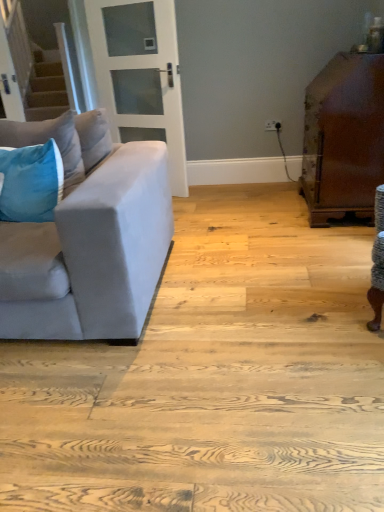
Question: From the image's perspective, does velvet blue pillow at left, the first pillow viewed from the top, appear higher than white glass door at upper center?

Choices:
 (A) yes
 (B) no

Answer: (B)

Question: Is velvet blue pillow at left, the 2th pillow in the bottom-to-top sequence, thinner than white glass door at upper center?

Choices:
 (A) yes
 (B) no

Answer: (B)

Question: Is the position of velvet blue pillow at left, the 2th pillow in the bottom-to-top sequence, less distant than that of white glass door at upper center?

Choices:
 (A) no
 (B) yes

Answer: (B)

Question: Considering the relative positions of velvet blue pillow at left, the first pillow viewed from the top, and white glass door at upper center in the image provided, is velvet blue pillow at left, the first pillow viewed from the top, to the left of white glass door at upper center from the viewer's perspective?

Choices:
 (A) yes
 (B) no

Answer: (A)

Question: Can you confirm if velvet blue pillow at left, the 2th pillow in the bottom-to-top sequence, is taller than white glass door at upper center?

Choices:
 (A) no
 (B) yes

Answer: (A)

Question: From the image's perspective, is velvet blue pillow at left, the first pillow viewed from the top, below white glass door at upper center?

Choices:
 (A) no
 (B) yes

Answer: (B)

Question: Does velvet blue pillow at left, the 2th pillow in the bottom-to-top sequence, appear on the right side of velvet blue pillow at left, arranged as the first pillow when ordered from the bottom?

Choices:
 (A) yes
 (B) no

Answer: (A)

Question: Does velvet blue pillow at left, the first pillow viewed from the top, have a smaller size compared to velvet blue pillow at left, which is the second pillow in top-to-bottom order?

Choices:
 (A) no
 (B) yes

Answer: (A)

Question: Does velvet blue pillow at left, the first pillow viewed from the top, have a larger size compared to velvet blue pillow at left, which is the second pillow in top-to-bottom order?

Choices:
 (A) no
 (B) yes

Answer: (B)

Question: Does velvet blue pillow at left, the 2th pillow in the bottom-to-top sequence, have a greater width compared to velvet blue pillow at left, arranged as the first pillow when ordered from the bottom?

Choices:
 (A) yes
 (B) no

Answer: (A)

Question: Can you confirm if velvet blue pillow at left, the first pillow viewed from the top, is positioned to the left of velvet blue pillow at left, which is the second pillow in top-to-bottom order?

Choices:
 (A) no
 (B) yes

Answer: (A)

Question: From the image's perspective, would you say velvet blue pillow at left, the first pillow viewed from the top, is shown under velvet blue pillow at left, arranged as the first pillow when ordered from the bottom?

Choices:
 (A) no
 (B) yes

Answer: (A)

Question: Is velvet blue pillow at left, arranged as the first pillow when ordered from the bottom, directly adjacent to velvet blue pillow at left, the first pillow viewed from the top?

Choices:
 (A) no
 (B) yes

Answer: (A)